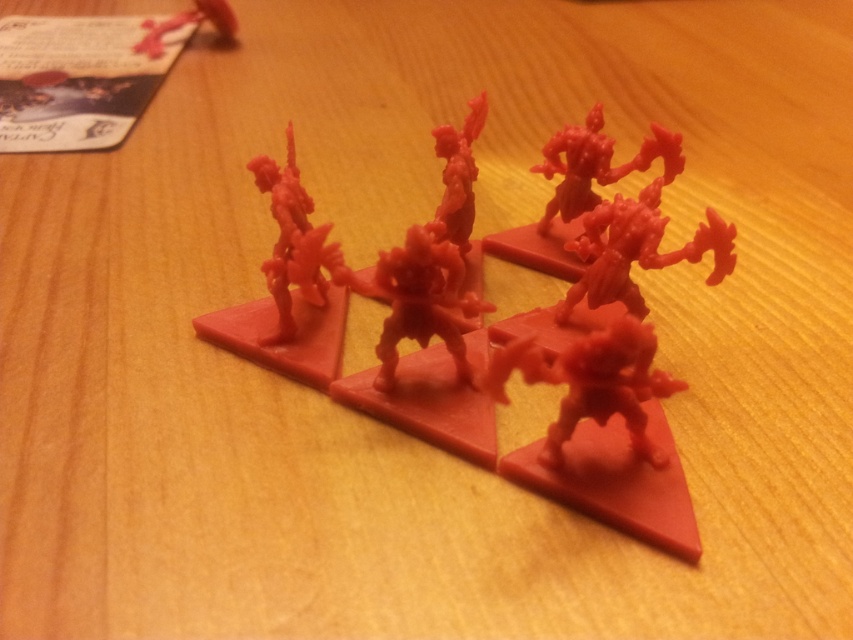
Question: Does matte plastic toy at center have a greater width compared to matte plastic toy at upper left?

Choices:
 (A) no
 (B) yes

Answer: (B)

Question: Which of the following is the closest to the observer?

Choices:
 (A) (305, 196)
 (B) (138, 49)

Answer: (A)

Question: Which object is the farthest from the matte plastic toy at upper left?

Choices:
 (A) matte plastic toy at center
 (B) matte plastic miniature at center

Answer: (A)

Question: Is matte plastic toy at center behind matte plastic miniature at center?

Choices:
 (A) no
 (B) yes

Answer: (A)

Question: Does matte plastic toy at center appear under matte plastic miniature at center?

Choices:
 (A) no
 (B) yes

Answer: (B)

Question: Which point is farther to the camera?

Choices:
 (A) matte plastic toy at upper left
 (B) matte plastic toy at center

Answer: (A)